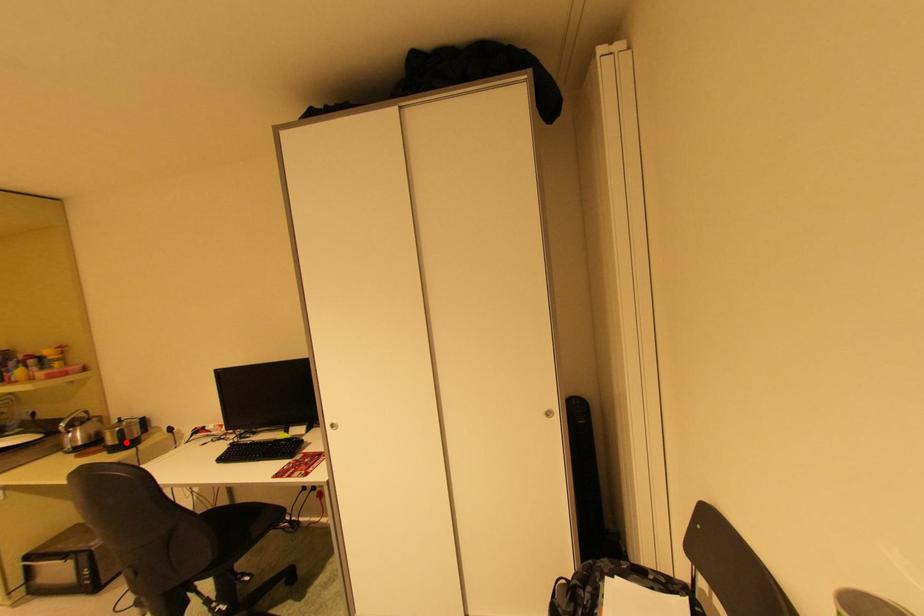
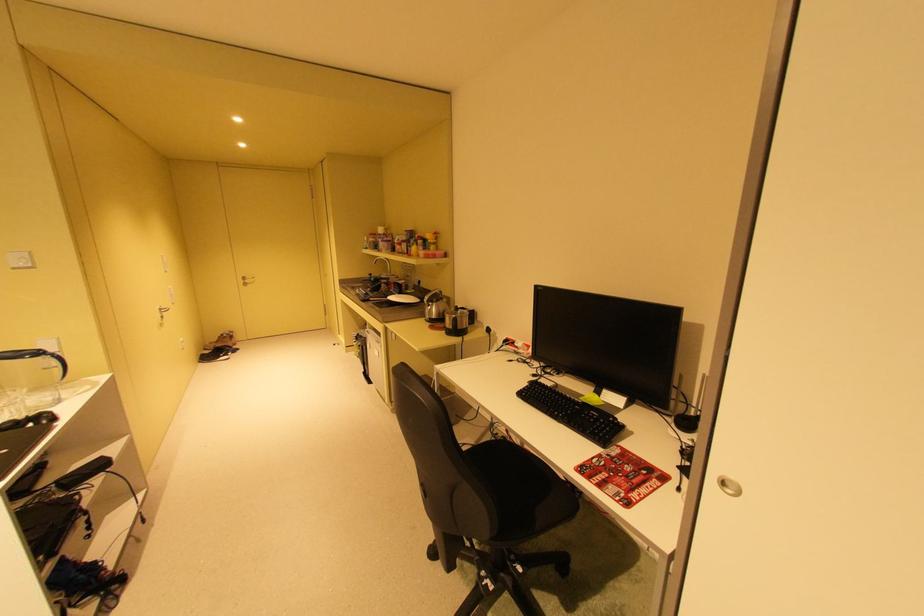
The point at the highlighted location is marked in the first image. Where is the corresponding point in the second image?

(460, 328)